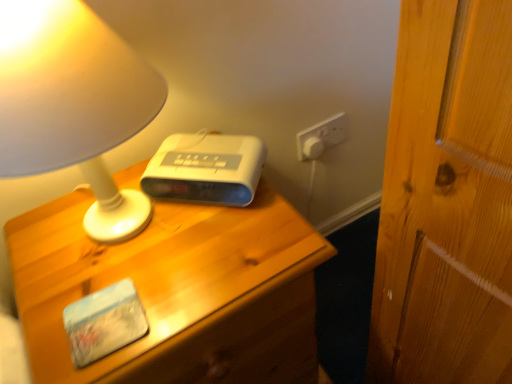
Describe the element at coordinates (74, 104) in the screenshot. I see `matte white lamp at upper left` at that location.

You are a GUI agent. You are given a task and a screenshot of the screen. Output one action in this format:
    pyautogui.click(x=<x>, y=<y>)
    Task: Click on the wooden nightstand at center
    Image resolution: width=512 pixels, height=384 pixels.
    Given the screenshot: What is the action you would take?
    pyautogui.click(x=177, y=291)

The width and height of the screenshot is (512, 384). Identify the location of white plastic alarm clock at center. (206, 169).

Who is taller, matte white lamp at upper left or white plastic alarm clock at center?

matte white lamp at upper left is taller.

Is matte white lamp at upper left bigger than white plastic alarm clock at center?

Indeed, matte white lamp at upper left has a larger size compared to white plastic alarm clock at center.

In the scene shown: Could you tell me if matte white lamp at upper left is facing white plastic alarm clock at center?

No, matte white lamp at upper left is not aimed at white plastic alarm clock at center.

How many degrees apart are the facing directions of matte white lamp at upper left and white plastic alarm clock at center?

The angular difference between matte white lamp at upper left and white plastic alarm clock at center is 43.3 degrees.

Choose the correct answer: Is wooden nightstand at center inside matte white lamp at upper left or outside it?

wooden nightstand at center lies outside matte white lamp at upper left.

From a real-world perspective, which object stands above the other?

In real-world perspective, matte white lamp at upper left is above.

Can you confirm if wooden nightstand at center is positioned to the left of matte white lamp at upper left?

Incorrect, wooden nightstand at center is not on the left side of matte white lamp at upper left.

From the image's perspective, between wooden nightstand at center and matte white lamp at upper left, who is located below?

wooden nightstand at center, from the image's perspective.

Between matte white lamp at upper left and wooden nightstand at center, which one has larger width?

Wider between the two is wooden nightstand at center.

From a real-world perspective, between matte white lamp at upper left and wooden nightstand at center, who is vertically lower?

From a 3D spatial view, wooden nightstand at center is below.

From the picture: Is matte white lamp at upper left to the right of wooden nightstand at center from the viewer's perspective?

Incorrect, matte white lamp at upper left is not on the right side of wooden nightstand at center.

From the image's perspective, which is above, matte white lamp at upper left or wooden nightstand at center?

matte white lamp at upper left is shown above in the image.

Considering the relative sizes of wooden nightstand at center and white plastic alarm clock at center in the image provided, is wooden nightstand at center smaller than white plastic alarm clock at center?

Actually, wooden nightstand at center might be larger than white plastic alarm clock at center.

Is wooden nightstand at center facing away from white plastic alarm clock at center?

No, wooden nightstand at center is not facing away from white plastic alarm clock at center.

Considering the sizes of wooden nightstand at center and white plastic alarm clock at center in the image, is wooden nightstand at center wider or thinner than white plastic alarm clock at center?

Considering their sizes, wooden nightstand at center looks broader than white plastic alarm clock at center.

Does white plastic alarm clock at center turn towards matte white lamp at upper left?

Yes, white plastic alarm clock at center is facing matte white lamp at upper left.

Considering the sizes of objects white plastic alarm clock at center and matte white lamp at upper left in the image provided, who is smaller, white plastic alarm clock at center or matte white lamp at upper left?

white plastic alarm clock at center.

Is point (169, 172) farther from camera compared to point (63, 48)?

That is True.

Between white plastic alarm clock at center and matte white lamp at upper left, which one has smaller width?

white plastic alarm clock at center.

Considering the relative positions of white plastic alarm clock at center and wooden nightstand at center in the image provided, is white plastic alarm clock at center to the left of wooden nightstand at center from the viewer's perspective?

In fact, white plastic alarm clock at center is to the right of wooden nightstand at center.

Is white plastic alarm clock at center inside or outside of wooden nightstand at center?

white plastic alarm clock at center is not inside wooden nightstand at center, it's outside.

Is white plastic alarm clock at center facing away from wooden nightstand at center?

That's not correct — white plastic alarm clock at center is not looking away from wooden nightstand at center.

At what (x,y) coordinates should I click in order to perform the action: click on lamp in front of the white plastic alarm clock at center. Please return your answer as a coordinate pair (x, y). Looking at the image, I should click on (74, 104).

Identify the location of nightstand that is below the matte white lamp at upper left (from the image's perspective). (177, 291).

From the image, which object appears to be nearer to white plastic alarm clock at center, matte white lamp at upper left or wooden nightstand at center?

The object closer to white plastic alarm clock at center is wooden nightstand at center.

Looking at the image, which one is located closer to wooden nightstand at center, white plastic alarm clock at center or matte white lamp at upper left?

white plastic alarm clock at center lies closer to wooden nightstand at center than the other object.

Looking at the image, which one is located further to white plastic alarm clock at center, wooden nightstand at center or matte white lamp at upper left?

The object further to white plastic alarm clock at center is matte white lamp at upper left.

Estimate the real-world distances between objects in this image. Which object is further from wooden nightstand at center, matte white lamp at upper left or white plastic alarm clock at center?

matte white lamp at upper left.

Looking at the image, which one is located closer to matte white lamp at upper left, wooden nightstand at center or white plastic alarm clock at center?

white plastic alarm clock at center is closer to matte white lamp at upper left.

Which object lies further to the anchor point matte white lamp at upper left, white plastic alarm clock at center or wooden nightstand at center?

wooden nightstand at center is positioned further to the anchor matte white lamp at upper left.

I want to click on gadget between matte white lamp at upper left and wooden nightstand at center from top to bottom, so click(x=206, y=169).